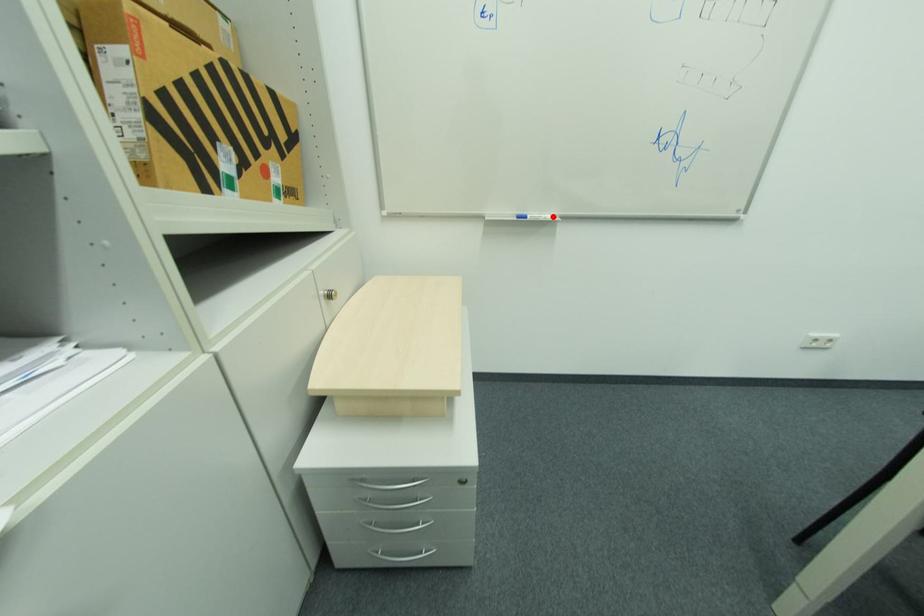
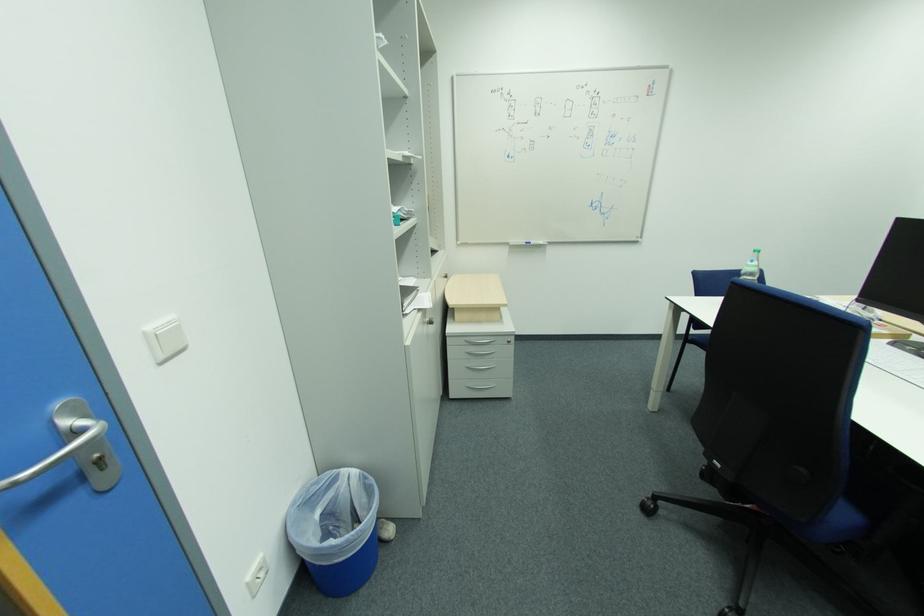
Where in the second image is the point corresponding to the highlighted location from the first image?

(546, 244)